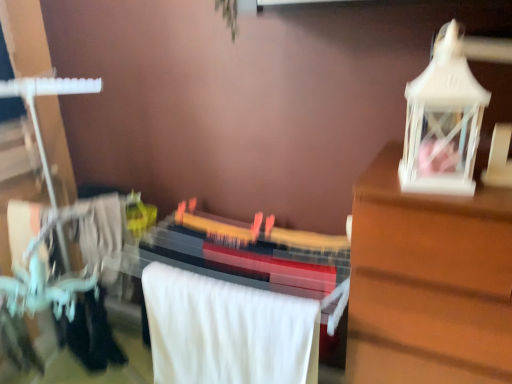
Where is `white soft towel at center`? The width and height of the screenshot is (512, 384). white soft towel at center is located at coordinates (227, 331).

At what (x,y) coordinates should I click in order to perform the action: click on white plastic lantern at upper right. Please return your answer as a coordinate pair (x, y). This screenshot has height=384, width=512. Looking at the image, I should click on (443, 121).

Locate an element on the screen. toy lying on the right of black fabric at lower left is located at coordinates (443, 121).

Is white plastic lantern at upper right to the left or to the right of black fabric at lower left in the image?

Based on their positions, white plastic lantern at upper right is located to the right of black fabric at lower left.

From the image's perspective, between white plastic lantern at upper right and black fabric at lower left, which one is located above?

white plastic lantern at upper right is shown above in the image.

You are a GUI agent. You are given a task and a screenshot of the screen. Output one action in this format:
    pyautogui.click(x=<x>, y=<y>)
    Task: Click on the clothing above the matte black guitar at center (from the image's perspective)
    The height and width of the screenshot is (384, 512).
    Given the screenshot: What is the action you would take?
    pyautogui.click(x=90, y=334)

Considering the sizes of objects black fabric at lower left and matte black guitar at center in the image provided, who is thinner, black fabric at lower left or matte black guitar at center?

black fabric at lower left is thinner.

In the scene shown: From the image's perspective, does black fabric at lower left appear lower than matte black guitar at center?

Actually, black fabric at lower left appears above matte black guitar at center in the image.

Is black fabric at lower left bigger than matte black guitar at center?

No, black fabric at lower left is not bigger than matte black guitar at center.

Between white soft towel at center and white plastic lantern at upper right, which one appears on the right side from the viewer's perspective?

white plastic lantern at upper right is more to the right.

From the image's perspective, is white soft towel at center located above or below white plastic lantern at upper right?

From the image's perspective, white soft towel at center appears below white plastic lantern at upper right.

Between white soft towel at center and white plastic lantern at upper right, which one has smaller size?

Smaller between the two is white plastic lantern at upper right.

From the picture: Is white soft towel at center beside white plastic lantern at upper right?

No.

Which is closer to the camera, (103, 338) or (241, 359)?

Clearly, point (103, 338) is more distant from the camera than point (241, 359).

Can you tell me how much black fabric at lower left and white soft towel at center differ in facing direction?

The facing directions of black fabric at lower left and white soft towel at center are 86.7 degrees apart.

From the image's perspective, would you say black fabric at lower left is shown under white soft towel at center?

Actually, black fabric at lower left appears above white soft towel at center in the image.

In the scene shown: Is black fabric at lower left beside white soft towel at center?

No, black fabric at lower left is not with white soft towel at center.

Considering the positions of objects white soft towel at center and black fabric at lower left in the image provided, who is behind, white soft towel at center or black fabric at lower left?

black fabric at lower left is further from the camera.

Is black fabric at lower left located within white soft towel at center?

That's incorrect, black fabric at lower left is not inside white soft towel at center.

From the picture: Which of these two, white soft towel at center or black fabric at lower left, is wider?

Wider between the two is white soft towel at center.

Which of these two, white soft towel at center or black fabric at lower left, is smaller?

Smaller between the two is black fabric at lower left.

In the image, is white plastic lantern at upper right positioned in front of or behind matte black guitar at center?

white plastic lantern at upper right is in front of matte black guitar at center.

Locate an element on the screen. This screenshot has height=384, width=512. closet that appears on the left of white plastic lantern at upper right is located at coordinates (256, 265).

Does point (408, 138) come farther from viewer compared to point (236, 246)?

No.

Can white soft towel at center be found inside matte black guitar at center?

Yes, matte black guitar at center contains white soft towel at center.

Does point (284, 266) come behind point (179, 355)?

No, (284, 266) is in front of (179, 355).

From the image's perspective, between matte black guitar at center and white soft towel at center, who is located below?

matte black guitar at center, from the image's perspective.

From a real-world perspective, relative to white soft towel at center, is matte black guitar at center vertically above or below?

matte black guitar at center is below white soft towel at center.

Find the location of a particular element. toy located above the black fabric at lower left (from a real-world perspective) is located at coordinates (443, 121).

Locate an element on the screen. The image size is (512, 384). closet beneath the black fabric at lower left (from a real-world perspective) is located at coordinates coord(256,265).

Which object lies nearer to the anchor point white plastic lantern at upper right, matte black guitar at center or white soft towel at center?

matte black guitar at center.

When comparing their distances from matte black guitar at center, does white soft towel at center or black fabric at lower left seem closer?

Among the two, white soft towel at center is located nearer to matte black guitar at center.

Estimate the real-world distances between objects in this image. Which object is further from black fabric at lower left, matte black guitar at center or white soft towel at center?

matte black guitar at center.

Considering their positions, is black fabric at lower left positioned further to matte black guitar at center than white soft towel at center?

Based on the image, black fabric at lower left appears to be further to matte black guitar at center.

From the image, which object appears to be nearer to black fabric at lower left, white plastic lantern at upper right or matte black guitar at center?

matte black guitar at center.

From the image, which object appears to be farther from matte black guitar at center, white plastic lantern at upper right or white soft towel at center?

The object further to matte black guitar at center is white plastic lantern at upper right.

Which object lies nearer to the anchor point black fabric at lower left, white plastic lantern at upper right or white soft towel at center?

Among the two, white soft towel at center is located nearer to black fabric at lower left.

From the picture: Which object lies nearer to the anchor point matte black guitar at center, white soft towel at center or white plastic lantern at upper right?

white soft towel at center is positioned closer to the anchor matte black guitar at center.

Identify the location of bath towel situated between black fabric at lower left and white plastic lantern at upper right from left to right. (227, 331).

Locate an element on the screen. bath towel between white plastic lantern at upper right and matte black guitar at center vertically is located at coordinates (227, 331).

Find the location of a particular element. Image resolution: width=512 pixels, height=384 pixels. closet between black fabric at lower left and white plastic lantern at upper right from left to right is located at coordinates (256, 265).

Where is `bath towel between black fabric at lower left and matte black guitar at center`? This screenshot has height=384, width=512. bath towel between black fabric at lower left and matte black guitar at center is located at coordinates (227, 331).